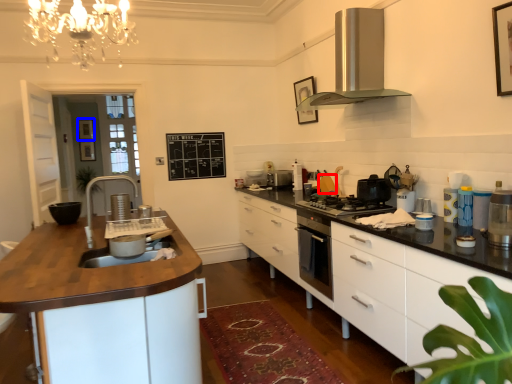
Question: Which object appears closest to the camera in this image, appliance (highlighted by a red box) or picture frame (highlighted by a blue box)?

Choices:
 (A) appliance
 (B) picture frame

Answer: (A)